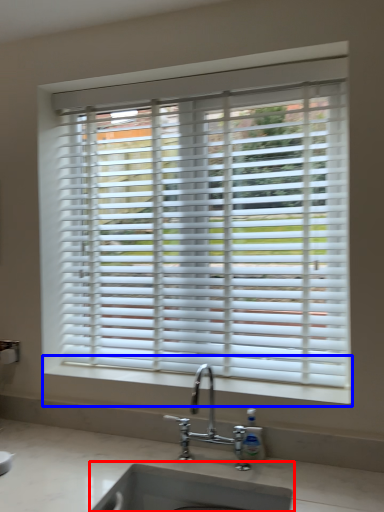
Question: Which of the following is the closest to the observer, sink (highlighted by a red box) or window sill (highlighted by a blue box)?

Choices:
 (A) sink
 (B) window sill

Answer: (A)